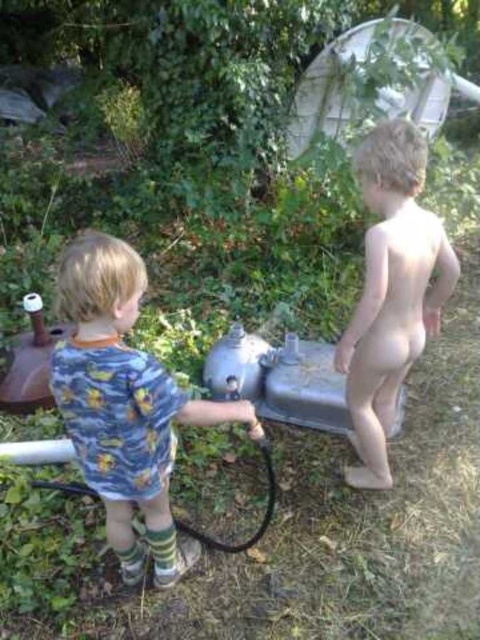
You are a photographer setting up a shot in the backyard scene. You have to decide which object to focus on first based on their sizes. Which one should you choose between the blue printed shirt at center and the black rubber hose at lower left?

The blue printed shirt at center is bigger than the black rubber hose at lower left, so you should focus on the blue printed shirt at center first because it is larger in size.

Based on the scene described, which object takes up more space in the image? Please consider the sizes of the pale skin nude boy at right and the black rubber hose at lower left.

The pale skin nude boy at right takes up more space in the image compared to the black rubber hose at lower left, as the boy has a larger size than the hose according to the description.